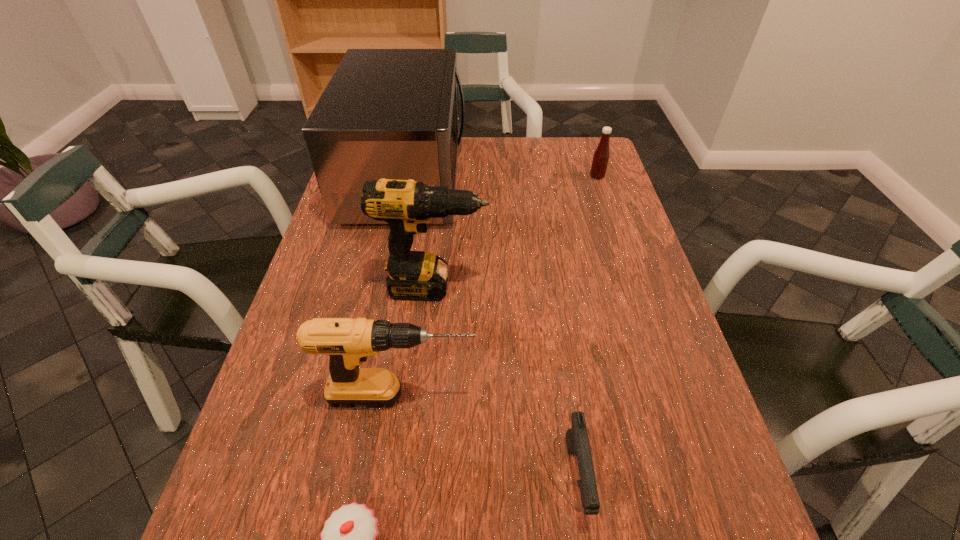
Locate an element on the screen. Image resolution: width=960 pixels, height=540 pixels. free space located at the tip of the taller drill is located at coordinates 636,287.

Image resolution: width=960 pixels, height=540 pixels. What are the coordinates of `free space located 0.120m at the tip of the third tallest object` in the screenshot? It's located at (540, 396).

This screenshot has height=540, width=960. I want to click on free space located on the back of the third shortest object, so click(x=588, y=147).

Identify the location of microwave oven that is at the far edge. Image resolution: width=960 pixels, height=540 pixels. (386, 113).

Find the location of a particular element. This screenshot has height=540, width=960. Tabasco sauce located in the far edge section of the desktop is located at coordinates coord(601,155).

Identify the location of microwave oven positioned at the left edge. (386, 113).

The height and width of the screenshot is (540, 960). What are the coordinates of `drill that is at the left edge` in the screenshot? It's located at (348, 342).

The height and width of the screenshot is (540, 960). What are the coordinates of `object present at the right edge` in the screenshot? It's located at (601, 155).

You are a GUI agent. You are given a task and a screenshot of the screen. Output one action in this format:
    pyautogui.click(x=<x>, y=<y>)
    Task: Click on the object situated at the far left corner
    The height and width of the screenshot is (540, 960).
    Given the screenshot: What is the action you would take?
    pyautogui.click(x=386, y=113)

Where is `object that is at the far right corner`? Image resolution: width=960 pixels, height=540 pixels. object that is at the far right corner is located at coordinates (601, 155).